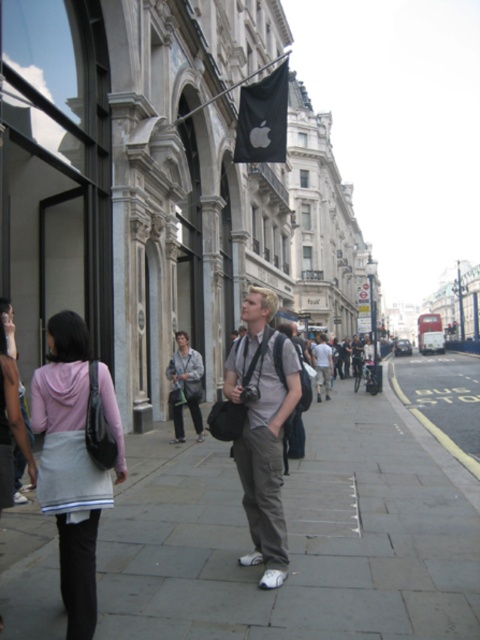
Question: Is light gray cotton pants at center in front of black fabric flag at upper center?

Choices:
 (A) no
 (B) yes

Answer: (B)

Question: In this image, where is matte pink hoodie at lower left located relative to light gray cotton pants at center?

Choices:
 (A) above
 (B) below

Answer: (A)

Question: Which object is the farthest from the light gray cotton pants at center?

Choices:
 (A) matte pink hoodie at lower left
 (B) khaki cotton pants at center
 (C) black fabric flag at upper center

Answer: (C)

Question: Which point appears closest to the camera in this image?

Choices:
 (A) (336, 632)
 (B) (40, 369)
 (C) (314, 355)
 (D) (231, 378)

Answer: (A)

Question: Which of the following is the farthest from the observer?

Choices:
 (A) (295, 552)
 (B) (62, 568)

Answer: (A)

Question: Does black fabric flag at upper center appear under khaki cotton pants at center?

Choices:
 (A) yes
 (B) no

Answer: (B)